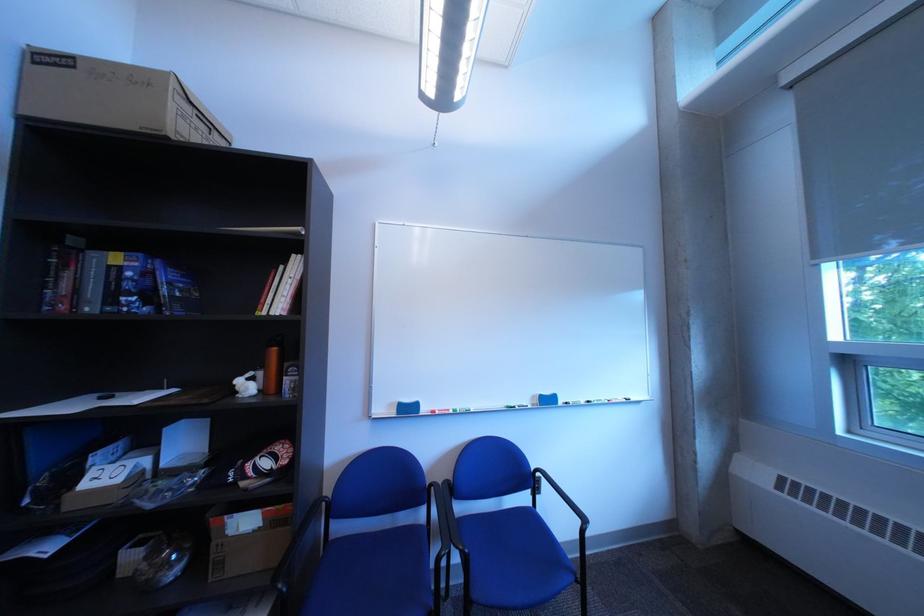
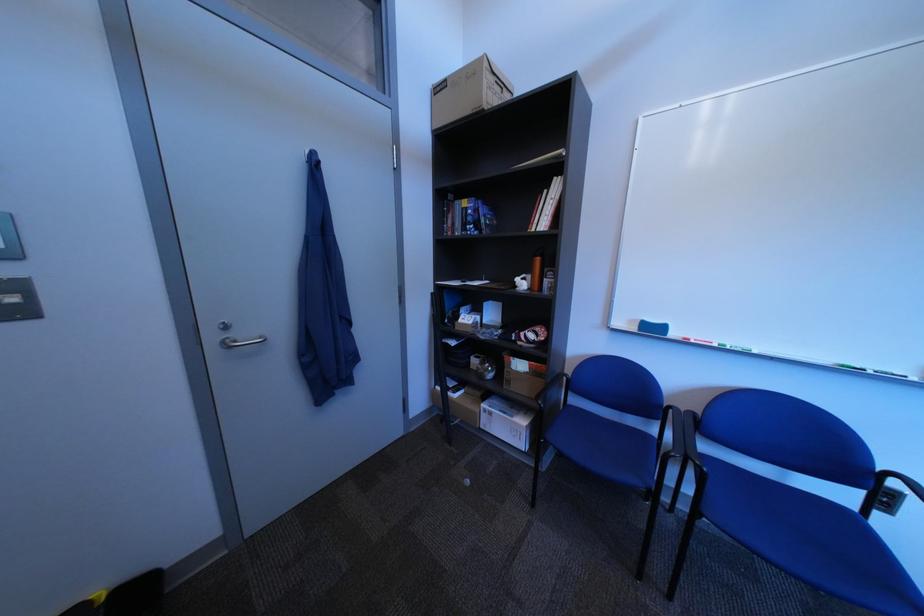
Locate, in the second image, the point that corresponds to point (554, 495) in the first image.

(906, 516)